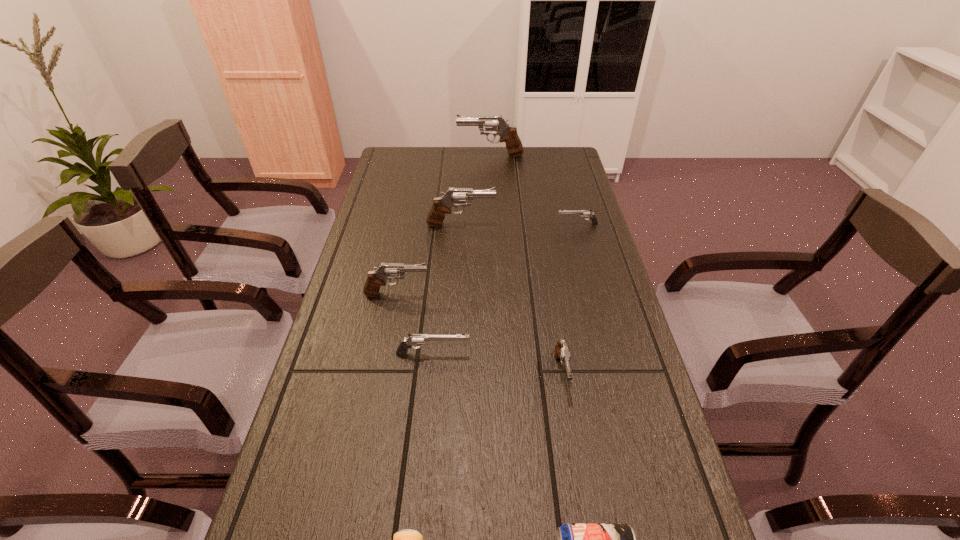
Find the location of a particular element. gray pistol that stands as the closest to the bigger silver pistol is located at coordinates (376, 278).